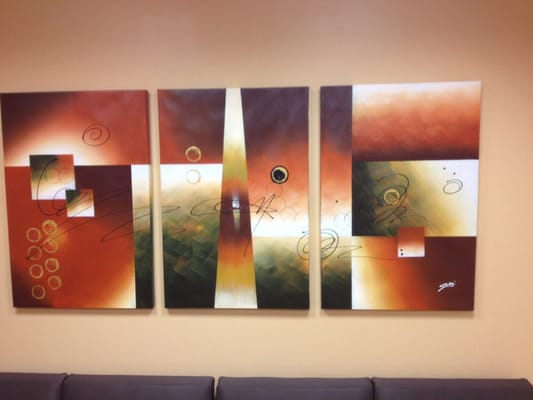
I want to click on cushion, so click(332, 384).